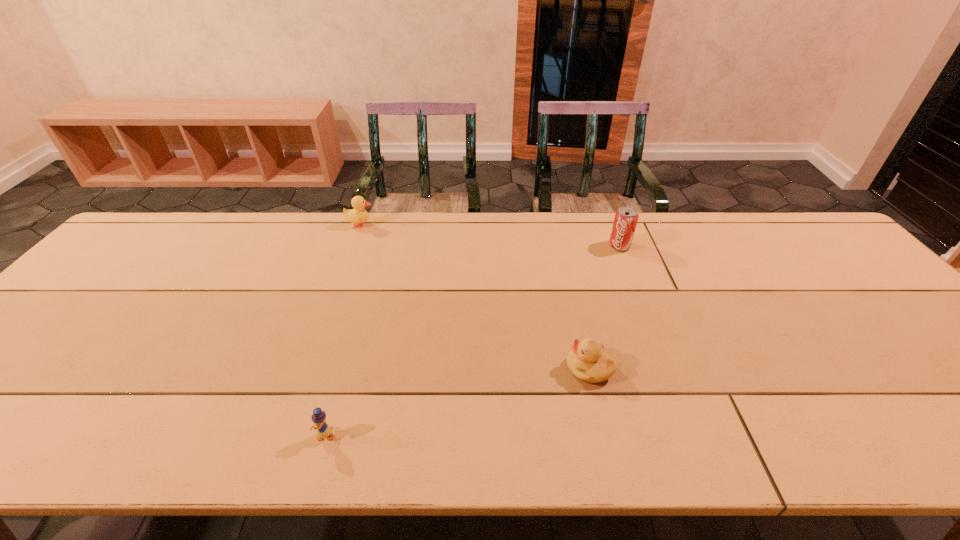
Find the location of a particular element. the third nearest object is located at coordinates (626, 217).

Locate an element on the screen. The image size is (960, 540). the tallest object is located at coordinates (626, 217).

The image size is (960, 540). I want to click on the second tallest object, so click(x=359, y=215).

This screenshot has height=540, width=960. I want to click on the farthest duckling, so click(359, 215).

Find the location of a particular element. The image size is (960, 540). the second nearest duckling is located at coordinates (587, 362).

What are the coordinates of `the third object from left to right` in the screenshot? It's located at (587, 362).

Where is `the second duckling from left to right`? the second duckling from left to right is located at coordinates (323, 430).

Find the location of `the nearest duckling`. the nearest duckling is located at coordinates (323, 430).

I want to click on free location located on the left of the tallest object, so click(501, 246).

Find the location of a particular element. free space located 0.150m on the front-facing side of the leftmost object is located at coordinates (421, 225).